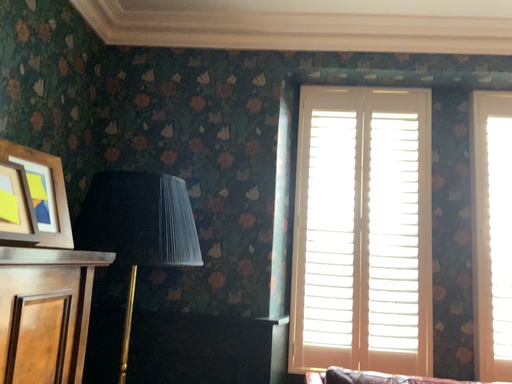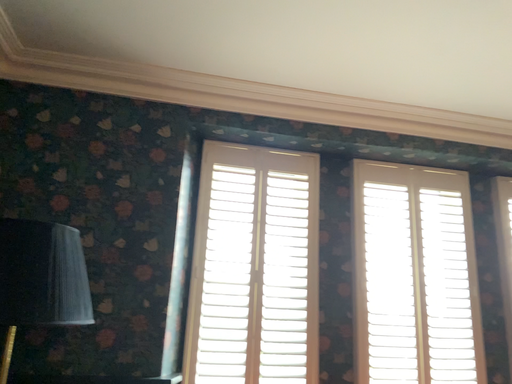
Question: How did the camera likely rotate when shooting the video?

Choices:
 (A) rotated right
 (B) rotated left

Answer: (A)